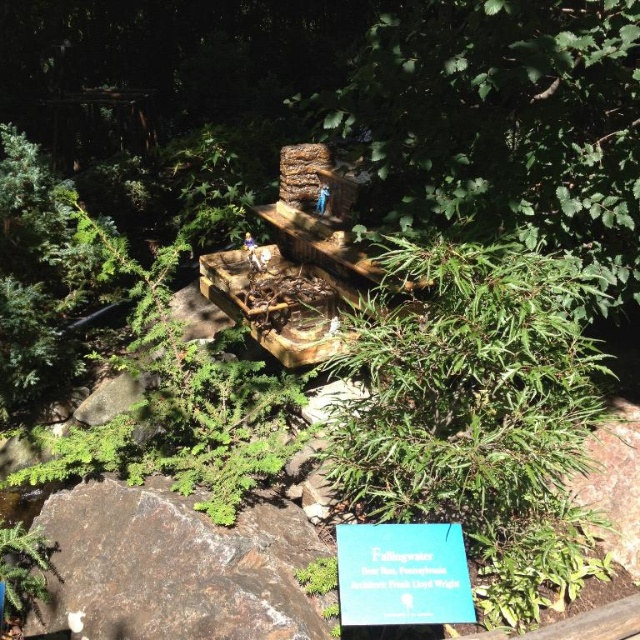
Can you confirm if blue paper sign at lower center is thinner than green leafy plant at lower left?

Incorrect, blue paper sign at lower center's width is not less than green leafy plant at lower left's.

Is blue paper sign at lower center shorter than green leafy plant at lower left?

Correct, blue paper sign at lower center is not as tall as green leafy plant at lower left.

This screenshot has width=640, height=640. I want to click on blue paper sign at lower center, so click(403, 573).

Between green leafy tree at center and green leafy plant at lower left, which one is positioned higher?

green leafy tree at center

Does green leafy tree at center appear on the right side of green leafy plant at lower left?

Correct, you'll find green leafy tree at center to the right of green leafy plant at lower left.

Who is more distant from viewer, [564,227] or [13,602]?

The point [564,227] is behind.

You are a GUI agent. You are given a task and a screenshot of the screen. Output one action in this format:
    pyautogui.click(x=<x>, y=<y>)
    Task: Click on the green leafy tree at center
    
    Given the screenshot: What is the action you would take?
    pyautogui.click(x=500, y=124)

Does green leafy tree at center have a greater width compared to blue paper sign at lower center?

Yes.

In the scene shown: Is green leafy tree at center shorter than blue paper sign at lower center?

No.

Is point (456, 168) positioned before point (451, 595)?

No, (456, 168) is further to viewer.

The image size is (640, 640). What are the coordinates of `green leafy tree at center` in the screenshot? It's located at (500, 124).